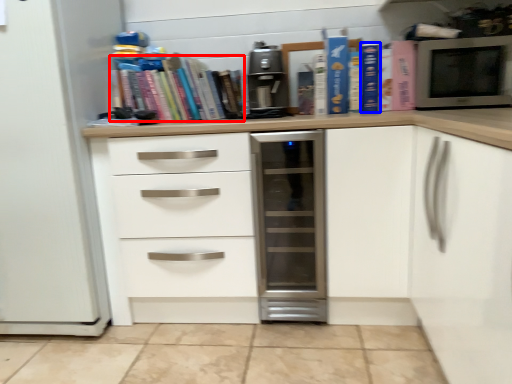
Question: Among these objects, which one is nearest to the camera, book (highlighted by a red box) or paperback book (highlighted by a blue box)?

Choices:
 (A) book
 (B) paperback book

Answer: (B)